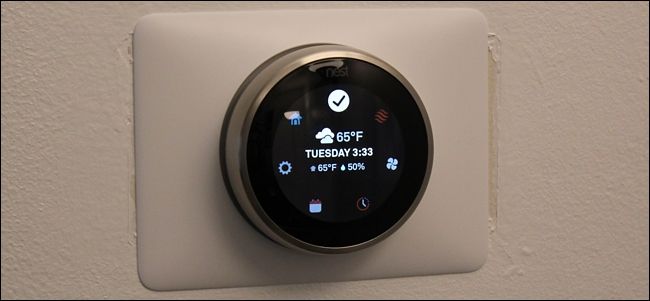
Find the location of a particular element. The height and width of the screenshot is (301, 650). clock is located at coordinates (361, 203).